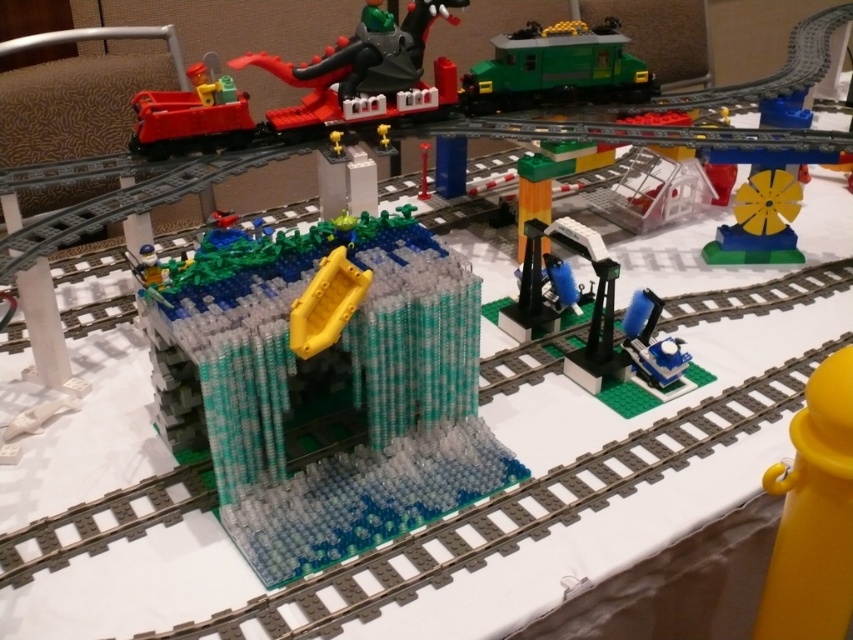
Question: Can you confirm if yellow plastic hook at upper right is positioned to the right of yellow matte wheel at upper right?

Choices:
 (A) yes
 (B) no

Answer: (B)

Question: Is shiny black dragon at upper center below yellow plastic lever at center?

Choices:
 (A) yes
 (B) no

Answer: (B)

Question: Which of the following is the farthest from the observer?

Choices:
 (A) (734, 211)
 (B) (235, 273)
 (C) (138, 122)

Answer: (A)

Question: Which point appears closest to the camera in this image?

Choices:
 (A) tap(821, 589)
 (B) tap(722, 257)

Answer: (A)

Question: Can you confirm if transparent plastic waterfall at center is positioned to the right of yellow plastic lever at center?

Choices:
 (A) yes
 (B) no

Answer: (B)

Question: Estimate the real-world distances between objects in this image. Which object is closer to the yellow plastic hook at upper right?

Choices:
 (A) blue plastic train at right
 (B) yellow matte wheel at upper right

Answer: (A)